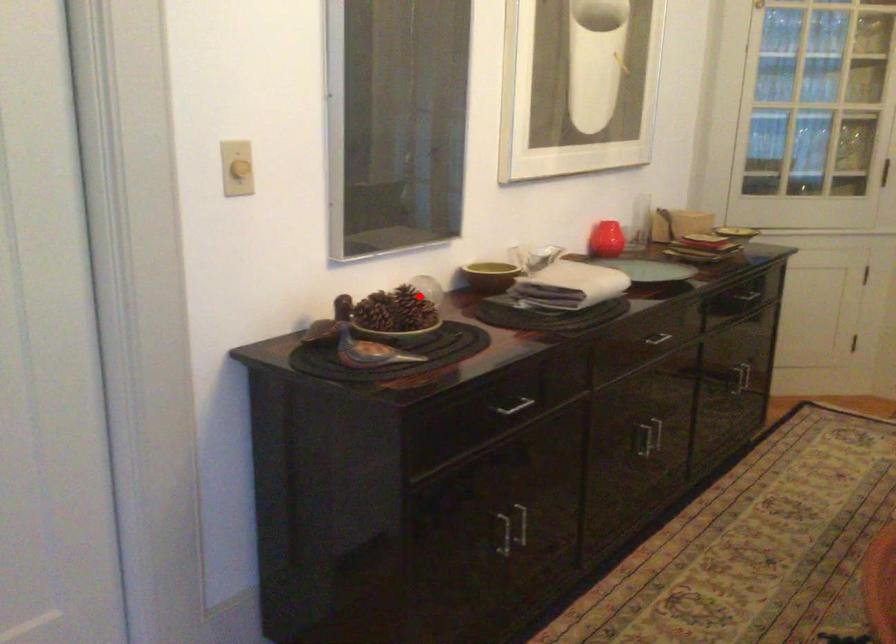
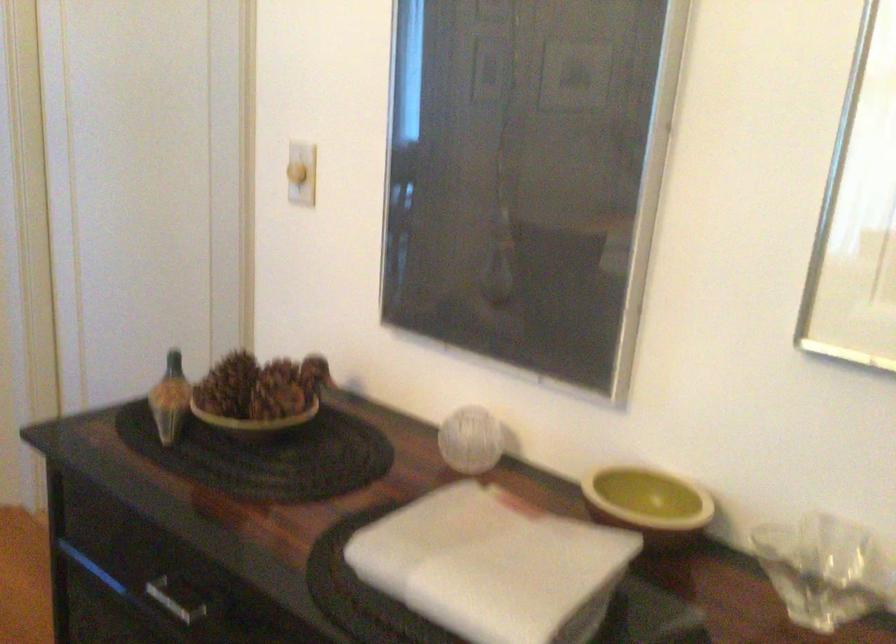
Locate, in the second image, the point that corresponds to the highlighted location in the first image.

(259, 395)